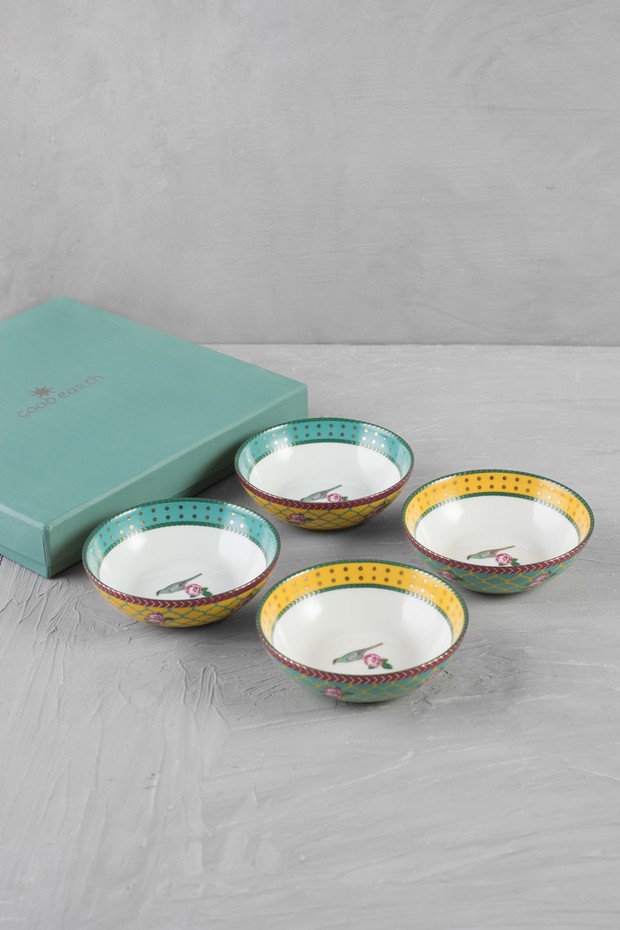
Identify the location of bowls. This screenshot has width=620, height=930. (343, 619), (219, 581), (346, 507), (507, 529).